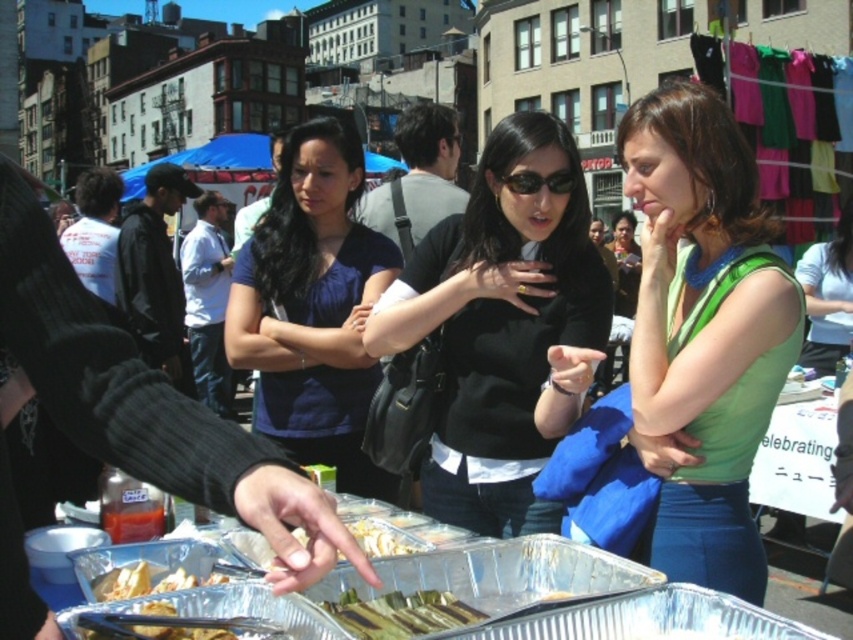
Question: Is green matte tank top at center below white glossy tortilla at center?

Choices:
 (A) yes
 (B) no

Answer: (B)

Question: Which object is positioned farthest from the green fabric shirt at center?

Choices:
 (A) shiny metallic skewers at center
 (B) matte blue shirt at center

Answer: (A)

Question: Does green fabric shirt at center have a smaller size compared to white glossy tortilla at center?

Choices:
 (A) no
 (B) yes

Answer: (A)

Question: Among these objects, which one is farthest from the camera?

Choices:
 (A) shiny metallic skewers at center
 (B) green fabric shirt at center
 (C) green matte tank top at center
 (D) matte blue shirt at center

Answer: (B)

Question: Considering the real-world distances, which object is closest to the black matte shirt at center?

Choices:
 (A) green fabric shirt at center
 (B) white glossy tortilla at center

Answer: (B)

Question: Is green matte tank top at center positioned at the back of sunglasses at center?

Choices:
 (A) no
 (B) yes

Answer: (A)